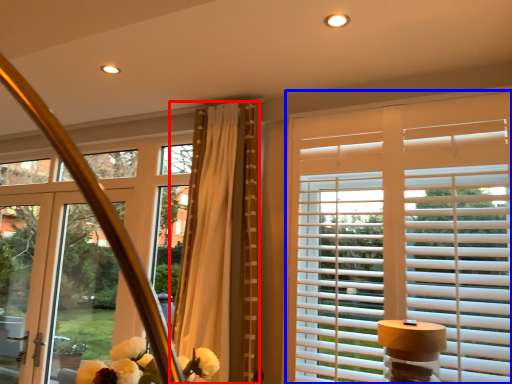
Question: Which of the following is the closest to the observer, curtain (highlighted by a red box) or window blind (highlighted by a blue box)?

Choices:
 (A) curtain
 (B) window blind

Answer: (B)